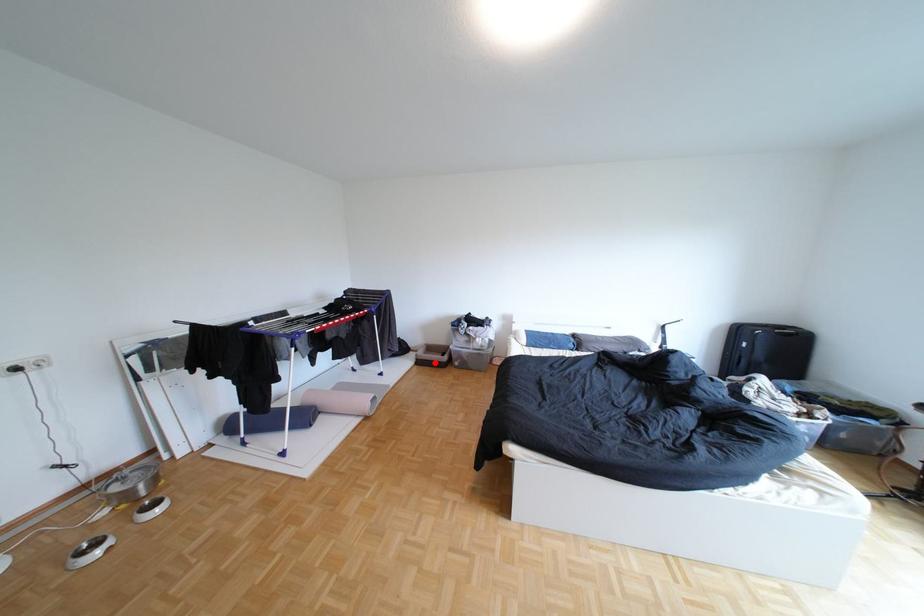
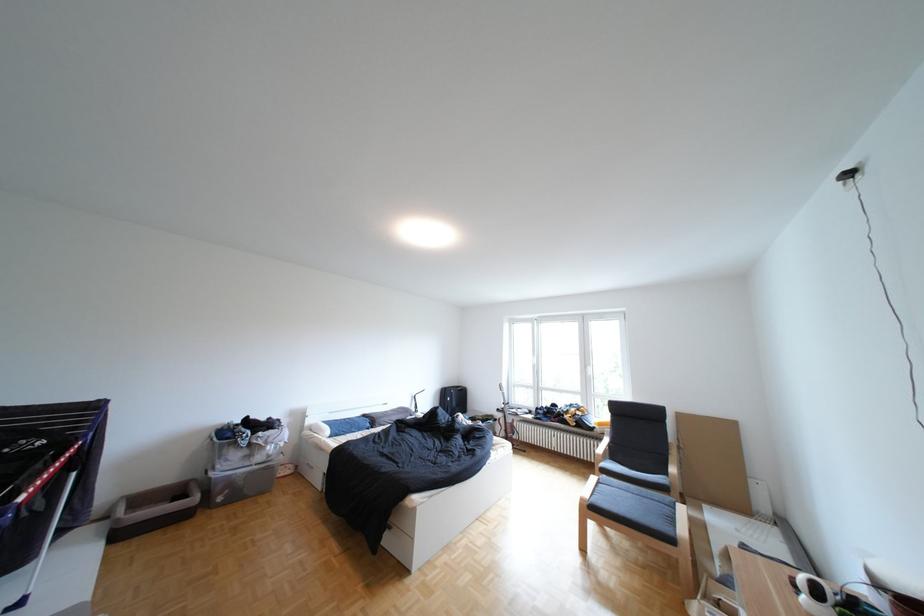
In the second image, find the point that corresponds to the highlighted location in the first image.

(136, 536)